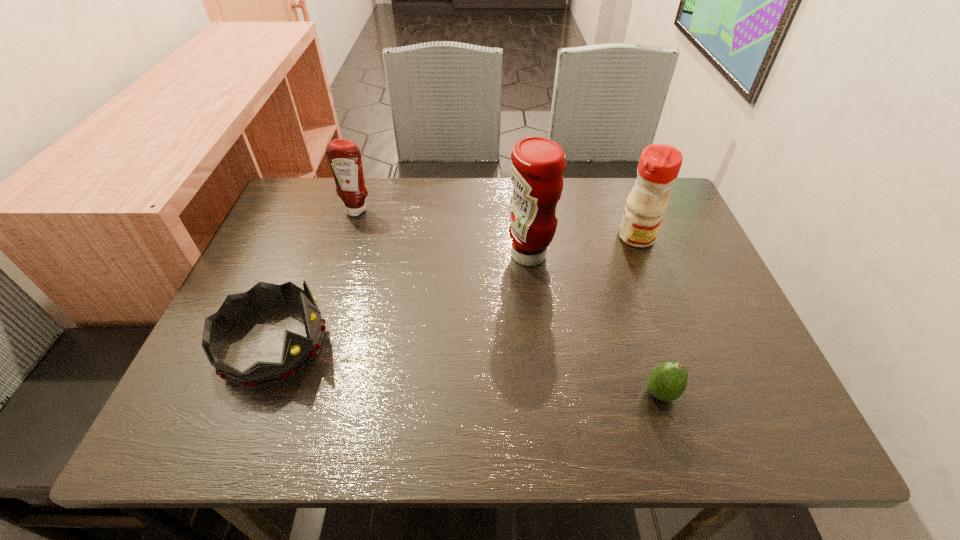
Where is `free spot that satisfies the following two spatial constraints: 1. on the front side of the rightmost condiment; 2. at the front of the second shortest object with jewels`? This screenshot has width=960, height=540. free spot that satisfies the following two spatial constraints: 1. on the front side of the rightmost condiment; 2. at the front of the second shortest object with jewels is located at coordinates (677, 344).